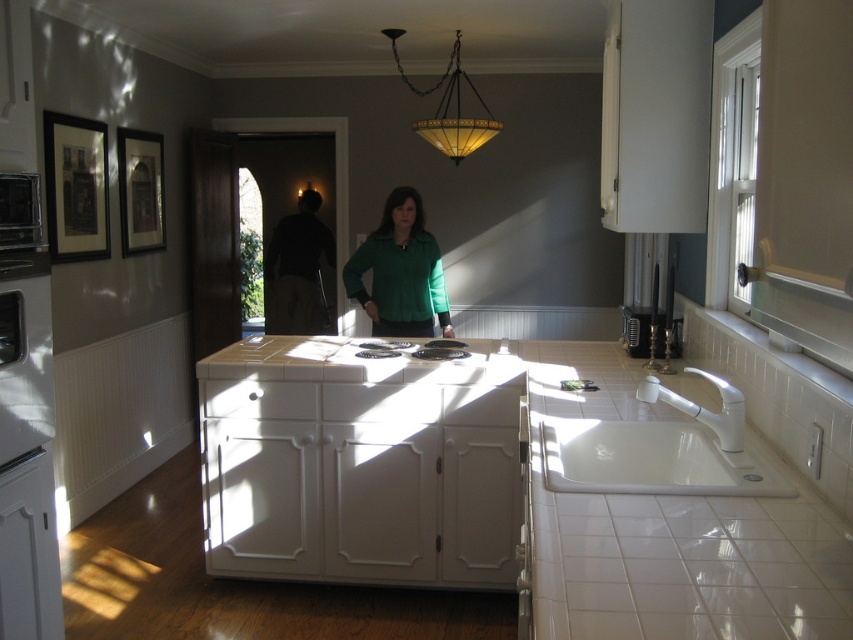
You are a photographer setting up a shoot in this kitchen. You notice two shirts hanging on a rack at center. The green matte shirt at center and the matte black shirt at center. Which shirt should you adjust to ensure it is in focus if your camera can only focus on the closest object?

You should adjust the matte black shirt at center because the green matte shirt at center is closer to the viewer, so the camera will focus on it first.

You are standing in the kitchen and want to place a bowl on the white tile countertop at center. Since the green matte shirt at center is in the way, can you move around it to access the countertop?

The white tile countertop at center is to the right of the green matte shirt at center, so you can move around to the right side of the green matte shirt at center to access the white tile countertop at center.

Based on the photo, you are a photographer setting up for a photoshoot in this kitchen. You need to position two shirts for a product shot. The shirts are the green matte shirt at center and the matte black shirt at center. According to the scene, which shirt should you move to the left to align them correctly?

The green matte shirt at center is already to the right of the matte black shirt at center, so you should move the green matte shirt at center to the left to align them correctly.